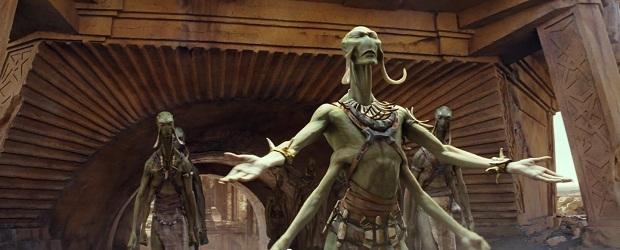
What are the coordinates of `engraved brown pillar` in the screenshot? It's located at (570, 52).